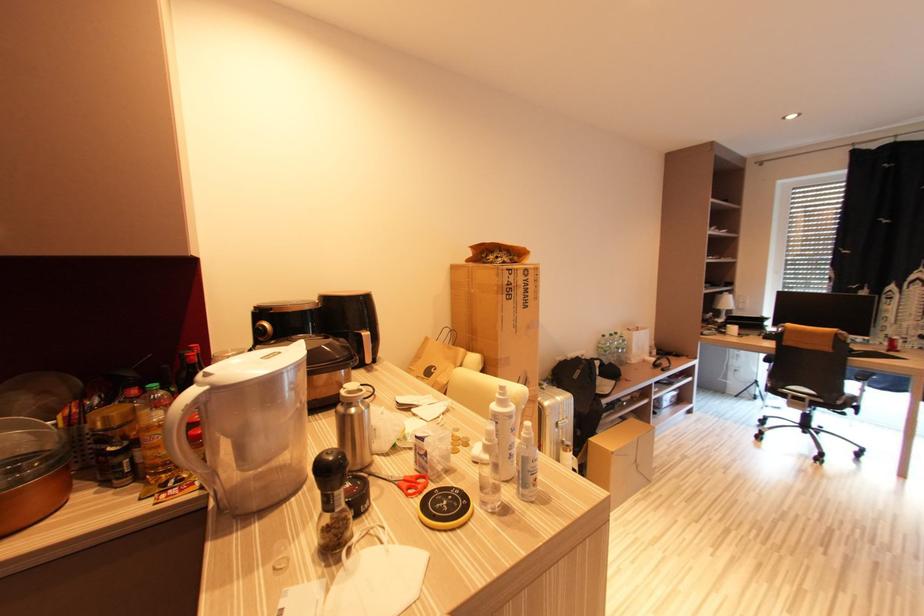
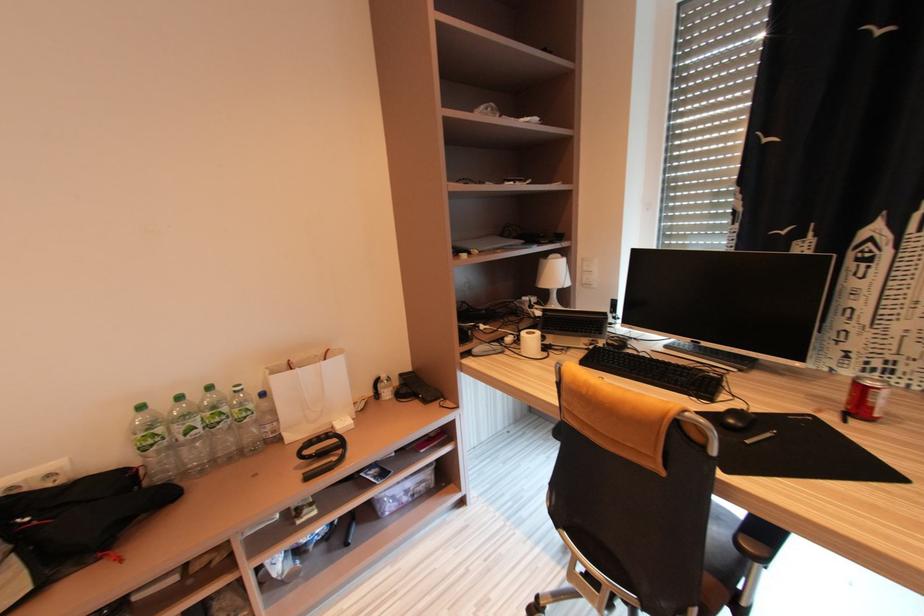
In a continuous first-person perspective shot, in which direction is the camera moving?

The movement direction of the cameraman is right, forward.